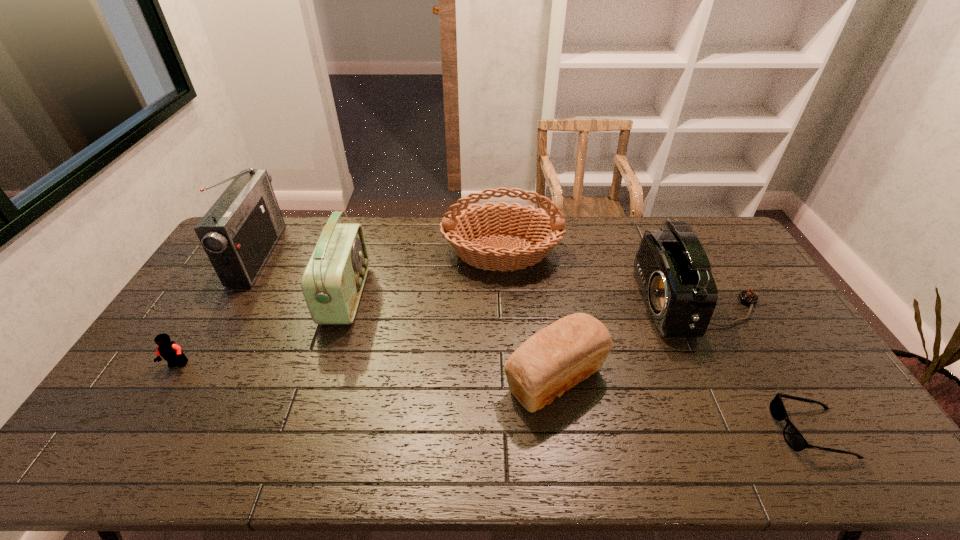
Image resolution: width=960 pixels, height=540 pixels. I want to click on basket that is at the far edge, so click(544, 229).

Identify the location of object at the near edge. (795, 440).

Where is `radio receiver at the left edge`? This screenshot has height=540, width=960. radio receiver at the left edge is located at coordinates (238, 233).

Where is `Lego that is at the left edge`? The image size is (960, 540). Lego that is at the left edge is located at coordinates (171, 352).

Locate an element on the screen. radio receiver that is at the right edge is located at coordinates (672, 268).

Where is `sunglasses at the right edge`? The height and width of the screenshot is (540, 960). sunglasses at the right edge is located at coordinates (795, 440).

At what (x,y) coordinates should I click in order to perform the action: click on object located in the far left corner section of the desktop. Please return your answer as a coordinate pair (x, y). Looking at the image, I should click on (x=238, y=233).

Locate an element on the screen. The width and height of the screenshot is (960, 540). object that is at the near right corner is located at coordinates (795, 440).

Find the location of a particular element. free space at the far edge of the desktop is located at coordinates (400, 237).

In the image, there is a desktop. Where is `vacant region at the near edge`? This screenshot has height=540, width=960. vacant region at the near edge is located at coordinates (255, 436).